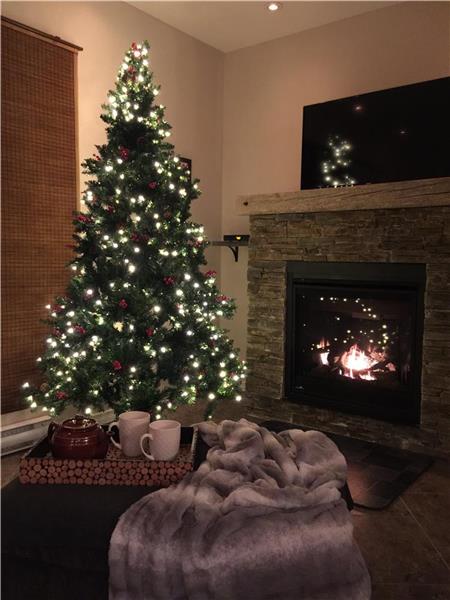
Find the location of a particular element. This screenshot has width=450, height=600. ceiling is located at coordinates (237, 24).